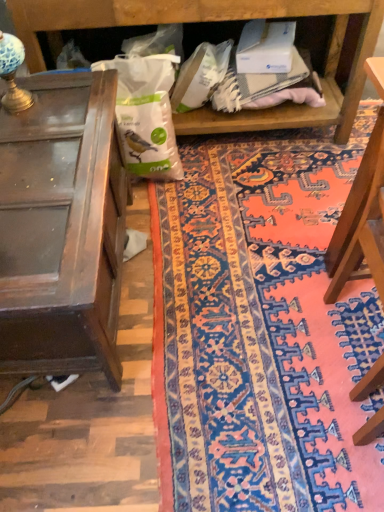
Question: From a real-world perspective, is wooden chair at right positioned above or below patterned carpet at center?

Choices:
 (A) above
 (B) below

Answer: (A)

Question: Looking at their shapes, would you say wooden chair at right is wider or thinner than patterned carpet at center?

Choices:
 (A) wide
 (B) thin

Answer: (B)

Question: Estimate the real-world distances between objects in this image. Which object is farther from the patterned carpet at center?

Choices:
 (A) blue glass lamp at upper left
 (B) wooden table at left
 (C) wooden chair at right
 (D) white matte paper bag at center

Answer: (A)

Question: Estimate the real-world distances between objects in this image. Which object is farther from the wooden table at left?

Choices:
 (A) blue glass lamp at upper left
 (B) patterned carpet at center
 (C) wooden chair at right
 (D) white matte paper bag at center

Answer: (C)